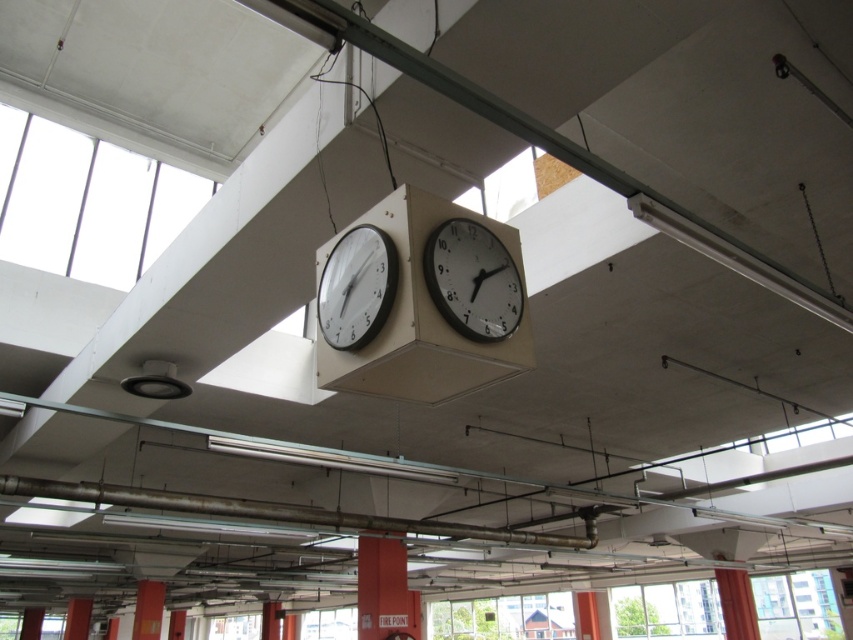
What do you see at coordinates (473, 280) in the screenshot? I see `white glossy clock at upper center` at bounding box center [473, 280].

Who is higher up, white glossy clock at upper center or white plastic clock at center?

Positioned higher is white glossy clock at upper center.

Is point (494, 285) in front of point (360, 276)?

That is False.

The height and width of the screenshot is (640, 853). I want to click on white glossy clock at upper center, so click(x=473, y=280).